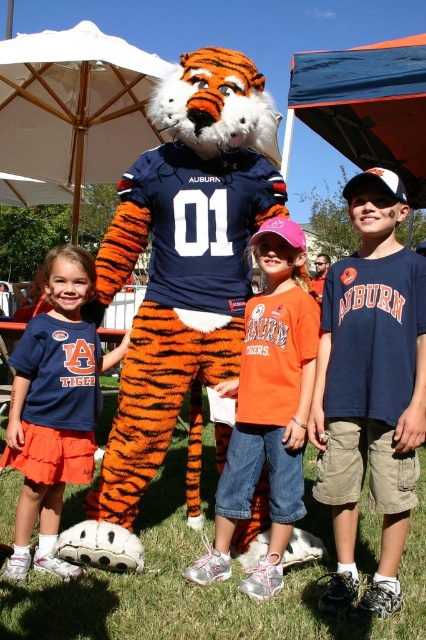
Question: Which of the following is the farthest from the observer?

Choices:
 (A) matte blue shirt at center
 (B) orange cotton shirt at center

Answer: (A)

Question: Is blue cotton shirt at center positioned at the back of matte blue shirt at center?

Choices:
 (A) no
 (B) yes

Answer: (A)

Question: Among these objects, which one is farthest from the camera?

Choices:
 (A) orange cotton shirt at center
 (B) orange tiger costume at center

Answer: (B)

Question: Does blue cotton shirt at center appear over matte blue shirt at center?

Choices:
 (A) yes
 (B) no

Answer: (A)

Question: Can you confirm if orange cotton shirt at center is positioned below matte blue shirt at center?

Choices:
 (A) no
 (B) yes

Answer: (A)

Question: Which point appears closest to the camera in this image?

Choices:
 (A) (419, 371)
 (B) (43, 364)
 (C) (282, 449)
 (D) (109, 465)

Answer: (A)